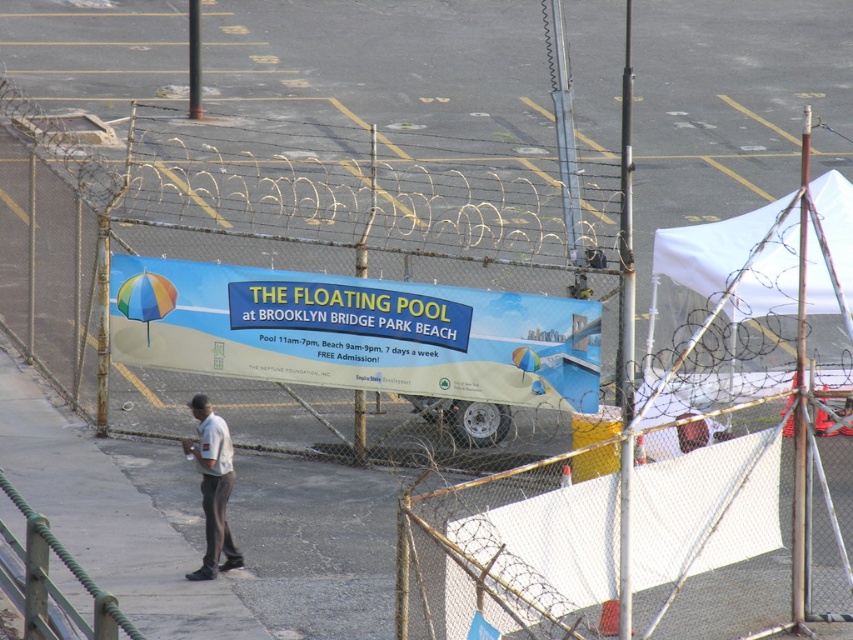
Question: Is the position of blue glossy sign at center more distant than that of white fabric canopy at upper right?

Choices:
 (A) yes
 (B) no

Answer: (B)

Question: Which of the following is the closest to the observer?

Choices:
 (A) white fabric canopy at upper right
 (B) white cotton shirt at center

Answer: (B)

Question: Among these points, which one is nearest to the camera?

Choices:
 (A) (659, 250)
 (B) (222, 547)

Answer: (B)

Question: Which point appears closest to the camera in this image?

Choices:
 (A) (229, 307)
 (B) (181, 330)
 (C) (834, 193)

Answer: (A)

Question: Does rusty chain-link fence at center come behind white fabric canopy at upper right?

Choices:
 (A) no
 (B) yes

Answer: (A)

Question: Can you confirm if rusty chain-link fence at center is smaller than white cotton shirt at center?

Choices:
 (A) yes
 (B) no

Answer: (B)